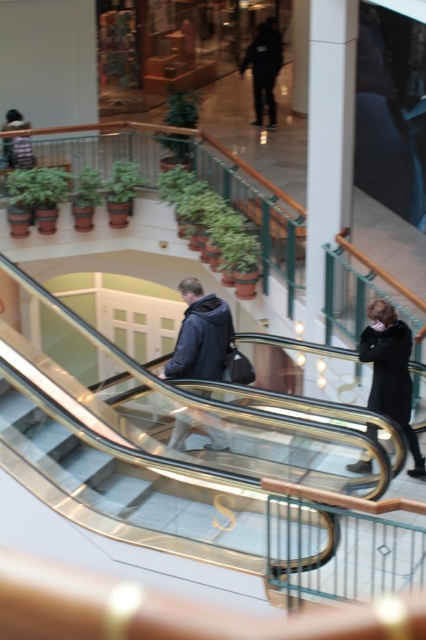
You are a delivery person carrying a large box that is 1 meter wide. You need to walk up the transparent glass stairs at center while avoiding the dark blue jacket at center. Is there enough space for you to pass safely?

The transparent glass stairs at center are wider than the dark blue jacket at center, so there should be enough space for the delivery person to navigate around the jacket while carrying the box safely.

You are a delivery person carrying a large box that is 1.2 meters wide. You need to move through the transparent glass stairs at center and the black wool coat at lower right. Which path should you choose to ensure the box fits through?

The transparent glass stairs at center has a width larger than the black wool coat at lower right, so you should choose the transparent glass stairs at center to move the large box since it can accommodate the 1.2 meters width.